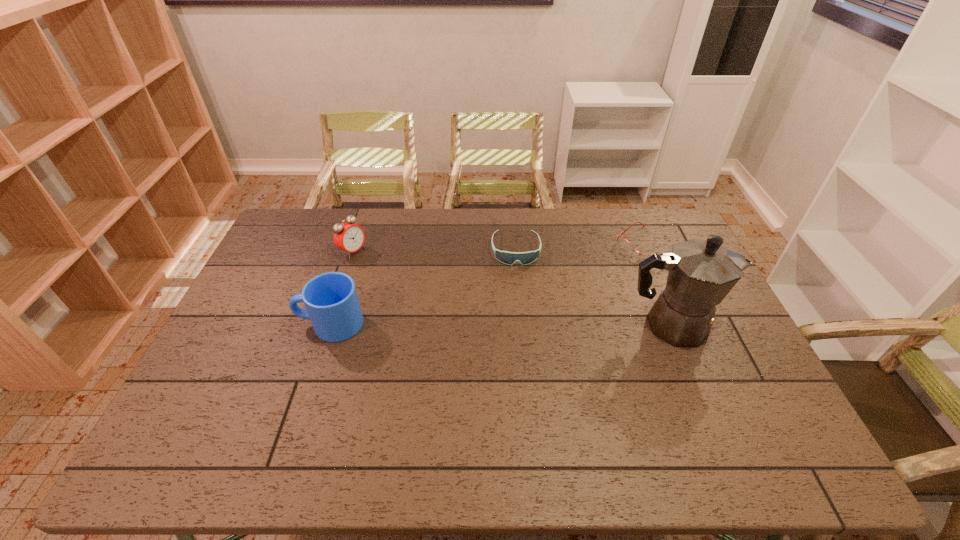
You are a GUI agent. You are given a task and a screenshot of the screen. Output one action in this format:
    pyautogui.click(x=<x>, y=<y>)
    Task: Click on the free point located on the front-facing side of the second shortest object
    This screenshot has height=540, width=960.
    Given the screenshot: What is the action you would take?
    pyautogui.click(x=523, y=334)

Where is `vacant area situated on the front-facing side of the second shortest object`? vacant area situated on the front-facing side of the second shortest object is located at coordinates (523, 342).

Identify the location of vacant position located 0.150m on the lenses of the shortest object. (603, 281).

Identify the location of vacant space situated on the lenses of the shortest object. (572, 302).

Identify the location of vacant space located on the lenses of the shortest object. This screenshot has width=960, height=540. (597, 285).

At what (x,y) coordinates should I click in order to perform the action: click on free location located on the front-facing side of the alarm clock. Please return your answer as a coordinate pair (x, y). Looking at the image, I should click on (431, 294).

Image resolution: width=960 pixels, height=540 pixels. I want to click on free point located 0.110m on the front-facing side of the alarm clock, so click(x=385, y=269).

Identify the location of vacant region located 0.300m on the front-facing side of the alarm clock. (428, 292).

Find the location of a particular element. This screenshot has width=960, height=540. goggles that is at the far edge is located at coordinates (509, 258).

Identify the location of spectacles positioned at the far edge. (624, 244).